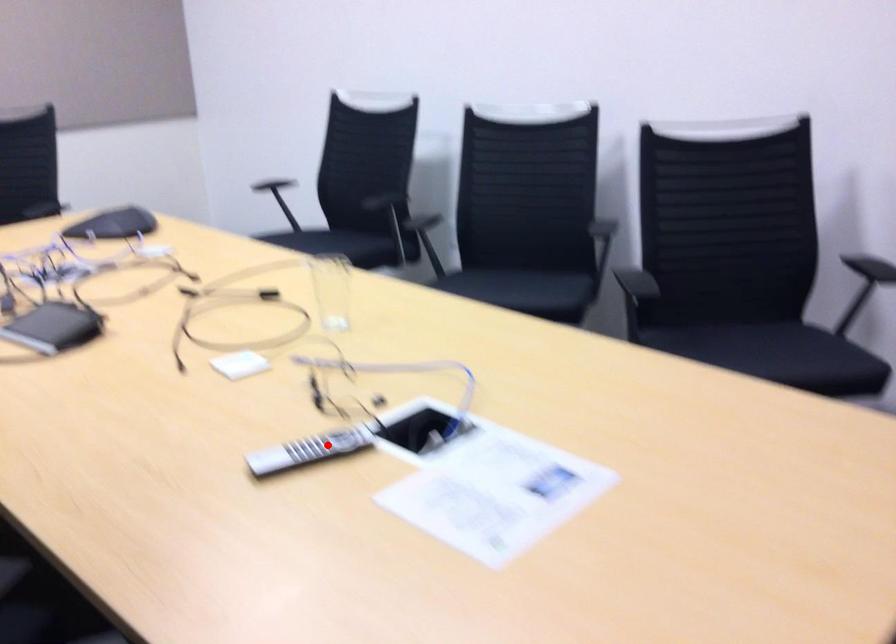
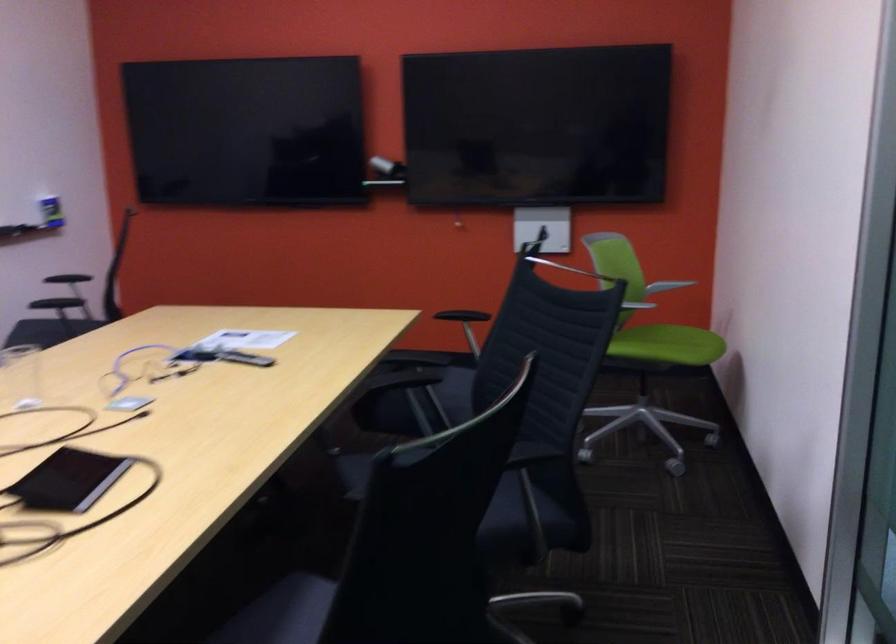
Locate, in the second image, the point that corresponds to the highlighted location in the first image.

(244, 357)